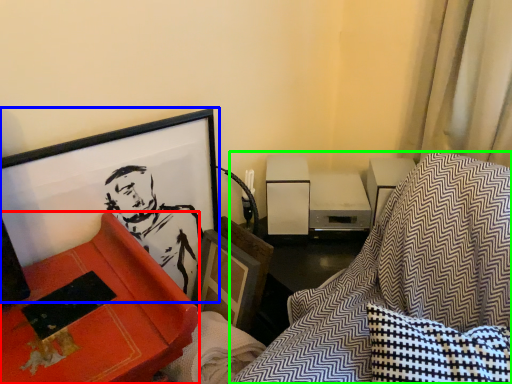
Question: Which object is positioned closest to furniture (highlighted by a red box)? Select from picture frame (highlighted by a blue box) and swivel chair (highlighted by a green box).

Choices:
 (A) picture frame
 (B) swivel chair

Answer: (A)